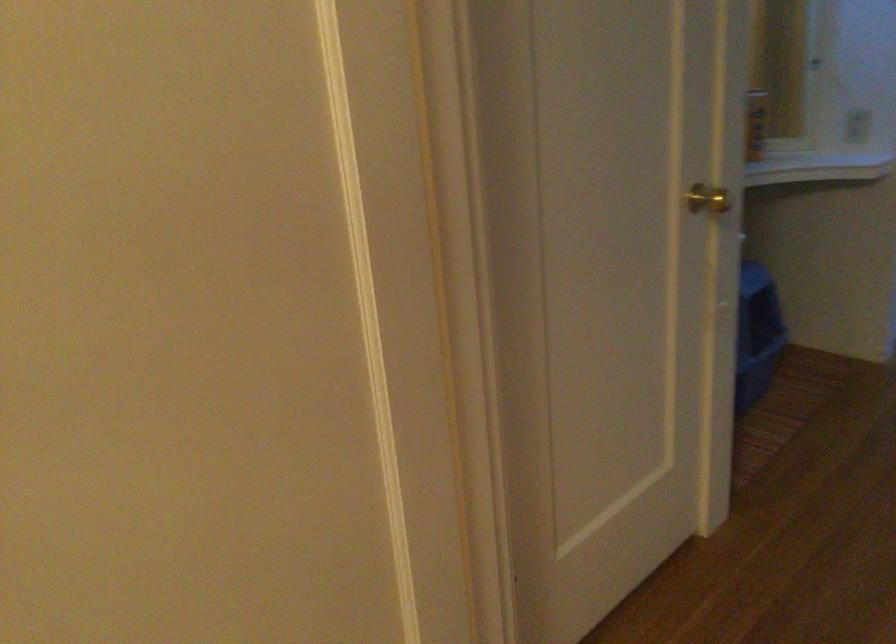
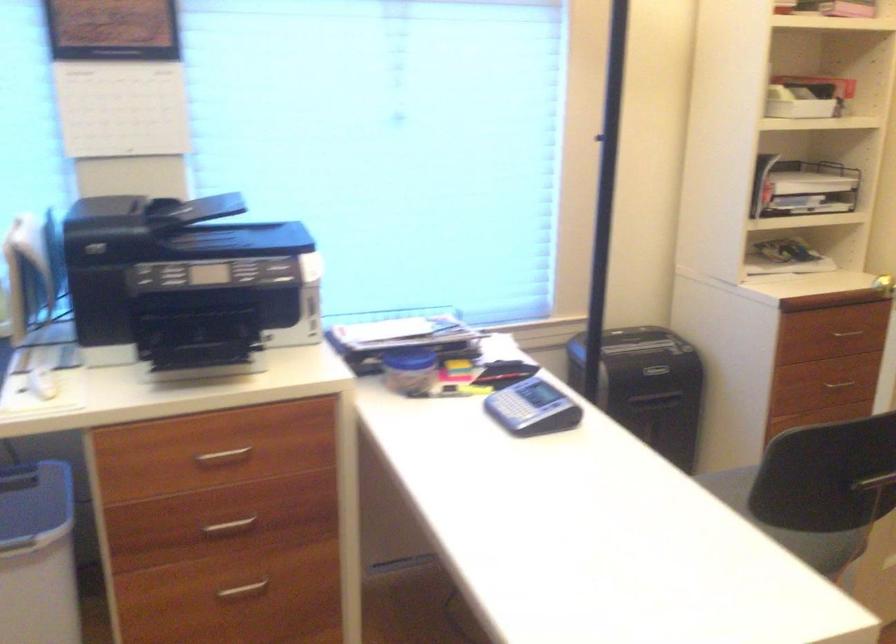
The images are taken continuously from a first-person perspective. In which direction are you moving?

The movement direction of the cameraman is left, backward.